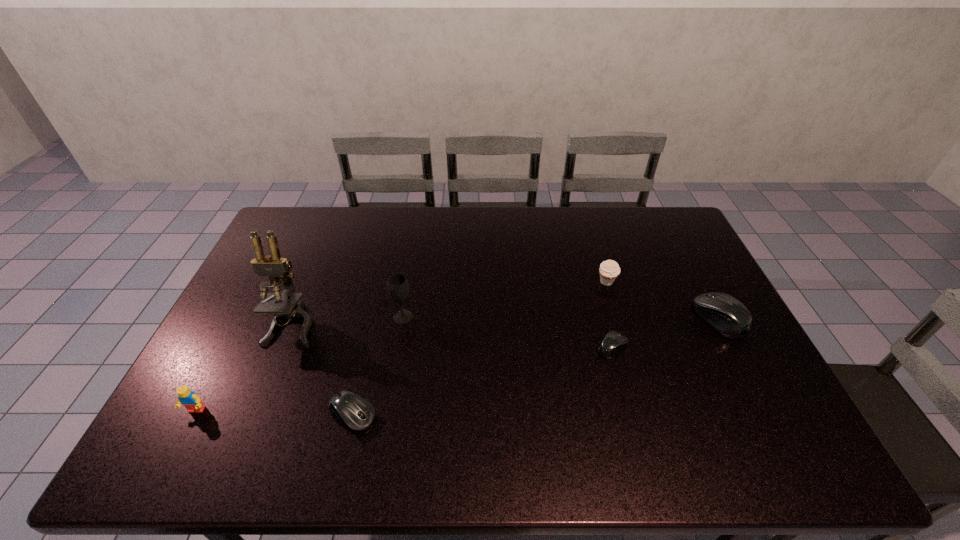
Image resolution: width=960 pixels, height=540 pixels. In order to click on the leftmost object in this screenshot , I will do `click(186, 397)`.

Locate an element on the screen. free location located on the right of the leftmost mouse is located at coordinates (518, 415).

Identify the location of vacant space located 0.350m on the left of the shortest mouse. (472, 347).

You are a GUI agent. You are given a task and a screenshot of the screen. Output one action in this format:
    pyautogui.click(x=<x>, y=<y>)
    Task: Click on the free region located on the front of the rightmost mouse
    The width and height of the screenshot is (960, 540).
    Given the screenshot: What is the action you would take?
    pyautogui.click(x=743, y=364)

Locate an element on the screen. This screenshot has width=960, height=540. vacant space located at the eyepieces of the tallest object is located at coordinates (262, 400).

Identify the location of blank area located 0.210m on the right of the muffin. This screenshot has height=540, width=960. (681, 282).

Locate an element on the screen. free spot located 0.380m on the left of the wineglass is located at coordinates (267, 317).

Where is `mouse present at the near edge`? mouse present at the near edge is located at coordinates (355, 413).

Identify the location of Lego located in the near edge section of the desktop. Image resolution: width=960 pixels, height=540 pixels. click(186, 397).

You are a GUI agent. You are given a task and a screenshot of the screen. Output one action in this format:
    pyautogui.click(x=<x>, y=<y>)
    Task: Click on the microscope that is at the left edge
    The height and width of the screenshot is (540, 960).
    Given the screenshot: What is the action you would take?
    pyautogui.click(x=273, y=266)